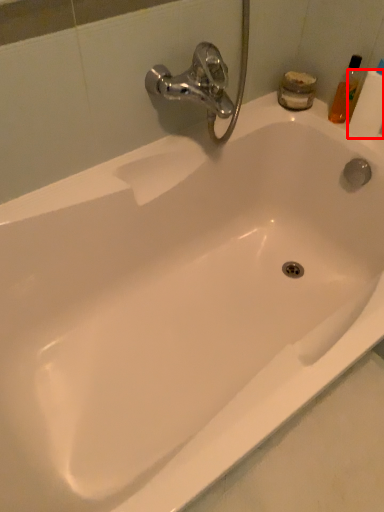
Question: Where is toilet paper (annotated by the red box) located in relation to toiletry in the image?

Choices:
 (A) right
 (B) left

Answer: (A)